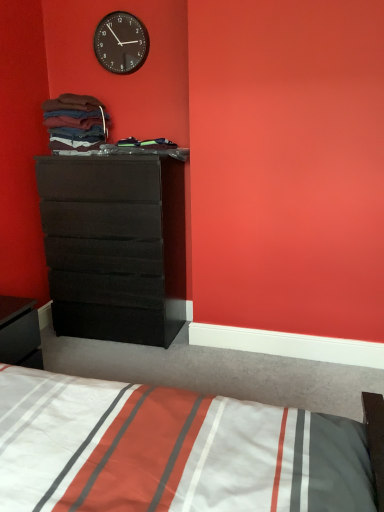
Find the location of a particular element. matte black dresser at left is located at coordinates (106, 249).

Locate an element on the screen. The width and height of the screenshot is (384, 512). black glossy nightstand at lower left is located at coordinates (19, 332).

The width and height of the screenshot is (384, 512). I want to click on white striped fabric at lower center, so click(x=170, y=450).

Considering the relative positions of black glossy nightstand at lower left and matte black dresser at left in the image provided, is black glossy nightstand at lower left to the left of matte black dresser at left from the viewer's perspective?

Indeed, black glossy nightstand at lower left is positioned on the left side of matte black dresser at left.

Between black glossy nightstand at lower left and matte black dresser at left, which one has smaller size?

black glossy nightstand at lower left is smaller.

Is black glossy nightstand at lower left looking in the opposite direction of matte black dresser at left?

No.

Which of these two, black glossy nightstand at lower left or matte black dresser at left, stands taller?

With more height is matte black dresser at left.

From the picture: Is there a large distance between matte black dresser at left and black glossy nightstand at lower left?

Actually, matte black dresser at left and black glossy nightstand at lower left are a little close together.

Is point (116, 167) closer or farther from the camera than point (23, 335)?

Clearly, point (116, 167) is more distant from the camera than point (23, 335).

Identify the location of nightstand below the matte black dresser at left (from the image's perspective). (19, 332).

Is matte black dresser at left located within multicolored fabric at upper left?

No, multicolored fabric at upper left does not contain matte black dresser at left.

From a real-world perspective, is multicolored fabric at upper left positioned over matte black dresser at left based on gravity?

Yes, from a real-world perspective, multicolored fabric at upper left is over matte black dresser at left

At what (x,y) coordinates should I click in order to perform the action: click on blanket located behind the matte black dresser at left. Please return your answer as a coordinate pair (x, y). Image resolution: width=384 pixels, height=512 pixels. Looking at the image, I should click on (76, 122).

Is multicolored fabric at upper left wider or thinner than matte black dresser at left?

Considering their sizes, multicolored fabric at upper left looks slimmer than matte black dresser at left.

Between point (31, 357) and point (67, 492), which one is positioned behind?

Point (31, 357)

Do you think black glossy nightstand at lower left is within white striped fabric at lower center, or outside of it?

black glossy nightstand at lower left is located beyond the bounds of white striped fabric at lower center.

Where is `nightstand that appears above the white striped fabric at lower center (from a real-world perspective)`? The height and width of the screenshot is (512, 384). nightstand that appears above the white striped fabric at lower center (from a real-world perspective) is located at coordinates (19, 332).

Which object is closer to the camera taking this photo, black glossy nightstand at lower left or white striped fabric at lower center?

Positioned in front is white striped fabric at lower center.

Between matte black dresser at left and multicolored fabric at upper left, which one has smaller size?

With smaller size is multicolored fabric at upper left.

How far apart are matte black dresser at left and multicolored fabric at upper left?

A distance of 21.19 inches exists between matte black dresser at left and multicolored fabric at upper left.

The height and width of the screenshot is (512, 384). What are the coordinates of `blanket above the matte black dresser at left (from the image's perspective)` in the screenshot? It's located at (76, 122).

From the image's perspective, which is above, matte black dresser at left or multicolored fabric at upper left?

multicolored fabric at upper left appears higher in the image.

Does black plastic wall clock at upper center have a greater width compared to matte black dresser at left?

No.

Could you tell me if black plastic wall clock at upper center is facing matte black dresser at left?

No, black plastic wall clock at upper center is not oriented towards matte black dresser at left.

Can you see black plastic wall clock at upper center touching matte black dresser at left?

black plastic wall clock at upper center and matte black dresser at left are clearly separated.

From the image's perspective, is black plastic wall clock at upper center positioned above or below matte black dresser at left?

A: black plastic wall clock at upper center is above matte black dresser at left.

Is white striped fabric at lower center to the right of matte black dresser at left from the viewer's perspective?

Yes, white striped fabric at lower center is to the right of matte black dresser at left.

Between white striped fabric at lower center and matte black dresser at left, which one has smaller width?

A: matte black dresser at left.

Are white striped fabric at lower center and matte black dresser at left beside each other?

white striped fabric at lower center and matte black dresser at left are not in contact.

Considering the sizes of objects white striped fabric at lower center and matte black dresser at left in the image provided, who is bigger, white striped fabric at lower center or matte black dresser at left?

Bigger between the two is matte black dresser at left.

The width and height of the screenshot is (384, 512). What are the coordinates of `nightstand beneath the matte black dresser at left (from a real-world perspective)` in the screenshot? It's located at (19, 332).

Locate an element on the screen. chest of drawers above the black glossy nightstand at lower left (from the image's perspective) is located at coordinates (106, 249).

Estimate the real-world distances between objects in this image. Which object is closer to white striped fabric at lower center, black glossy nightstand at lower left or black plastic wall clock at upper center?

Based on the image, black glossy nightstand at lower left appears to be nearer to white striped fabric at lower center.

Looking at this image, from the image, which object appears to be farther from black glossy nightstand at lower left, matte black dresser at left or multicolored fabric at upper left?

multicolored fabric at upper left is positioned further to the anchor black glossy nightstand at lower left.

Based on their spatial positions, is black plastic wall clock at upper center or multicolored fabric at upper left further from white striped fabric at lower center?

black plastic wall clock at upper center.

Looking at the image, which one is located further to multicolored fabric at upper left, matte black dresser at left or black plastic wall clock at upper center?

The object further to multicolored fabric at upper left is matte black dresser at left.

Looking at the image, which one is located further to black glossy nightstand at lower left, black plastic wall clock at upper center or white striped fabric at lower center?

Among the two, black plastic wall clock at upper center is located further to black glossy nightstand at lower left.

Estimate the real-world distances between objects in this image. Which object is closer to black glossy nightstand at lower left, white striped fabric at lower center or multicolored fabric at upper left?

white striped fabric at lower center is closer to black glossy nightstand at lower left.

When comparing their distances from black glossy nightstand at lower left, does white striped fabric at lower center or black plastic wall clock at upper center seem further?

black plastic wall clock at upper center is positioned further to the anchor black glossy nightstand at lower left.

When comparing their distances from matte black dresser at left, does multicolored fabric at upper left or black glossy nightstand at lower left seem closer?

Among the two, multicolored fabric at upper left is located nearer to matte black dresser at left.

Locate an element on the screen. Image resolution: width=384 pixels, height=512 pixels. blanket between black plastic wall clock at upper center and black glossy nightstand at lower left from top to bottom is located at coordinates (76, 122).

Where is `the chest of drawers situated between black glossy nightstand at lower left and white striped fabric at lower center from left to right`? the chest of drawers situated between black glossy nightstand at lower left and white striped fabric at lower center from left to right is located at coordinates (106, 249).

Find the location of `nightstand between multicolored fabric at upper left and white striped fabric at lower center in the vertical direction`. nightstand between multicolored fabric at upper left and white striped fabric at lower center in the vertical direction is located at coordinates (19, 332).

Where is `blanket between black plastic wall clock at upper center and matte black dresser at left vertically`? blanket between black plastic wall clock at upper center and matte black dresser at left vertically is located at coordinates click(x=76, y=122).